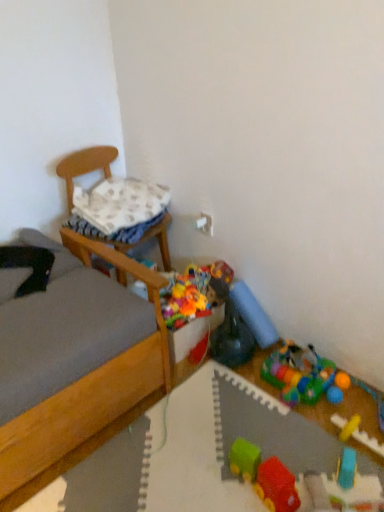
The width and height of the screenshot is (384, 512). I want to click on vacant space that is to the left of yellow rubber train at lower right, which is the 2th toy from front to back, so click(317, 444).